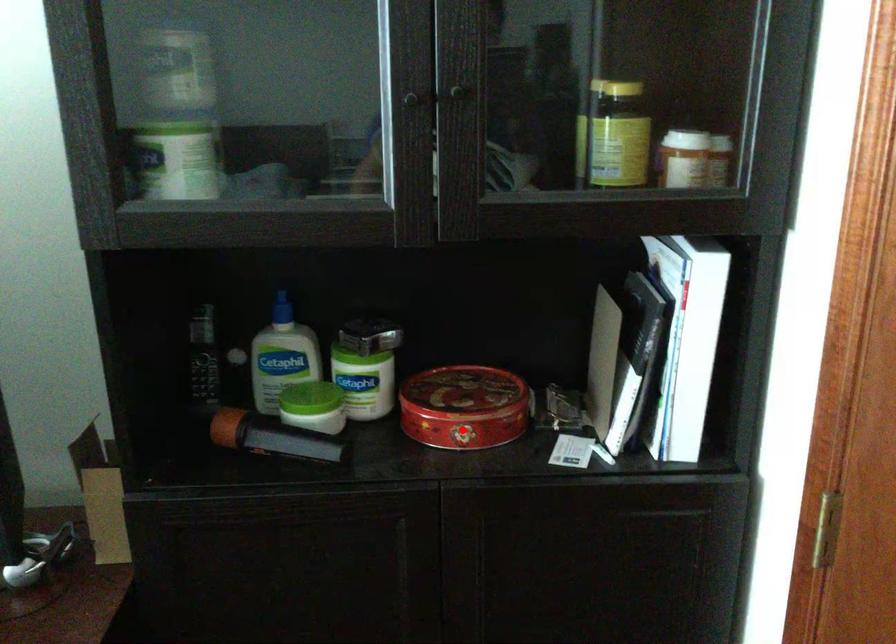
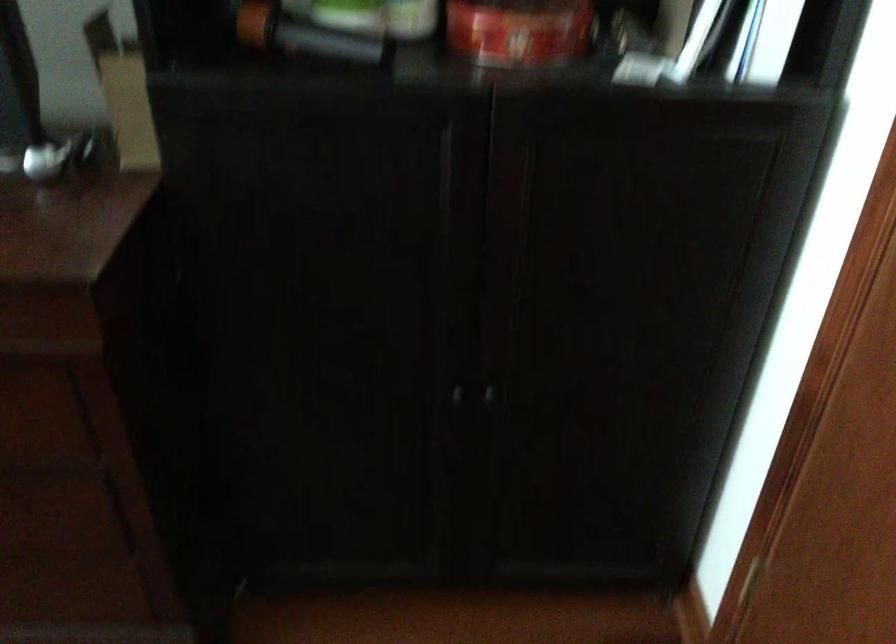
Find the pixel in the second image that matches the highlighted location in the first image.

(519, 31)